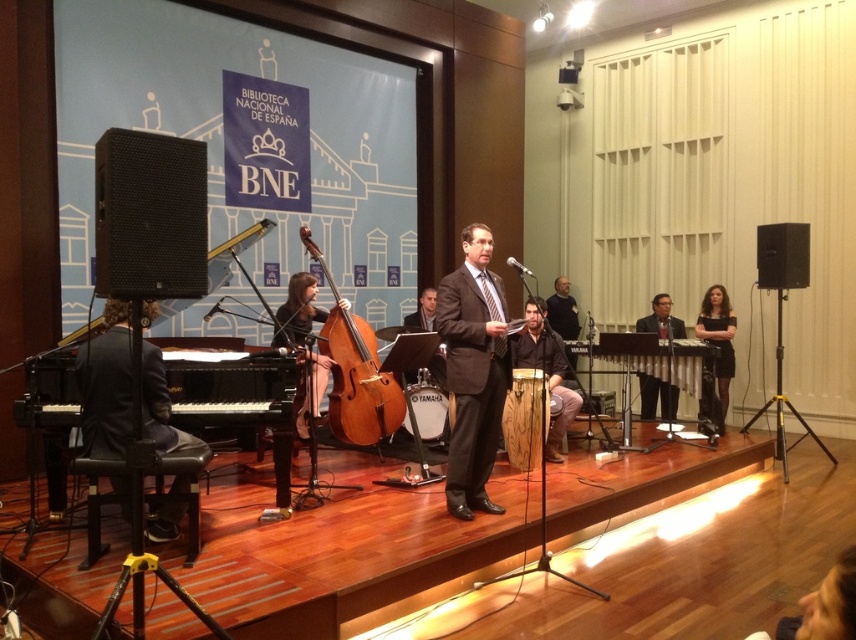
Who is positioned more to the left, brown wooden cello at center or matte brown cello at center?

matte brown cello at center

Does point (351, 426) come closer to viewer compared to point (310, 380)?

No, it is not.

The height and width of the screenshot is (640, 856). I want to click on brown wooden cello at center, so click(355, 371).

You are a GUI agent. You are given a task and a screenshot of the screen. Output one action in this format:
    pyautogui.click(x=<x>, y=<y>)
    Task: Click on the brown wooden cello at center
    
    Given the screenshot: What is the action you would take?
    pyautogui.click(x=355, y=371)

Is wooden drum at center above matte brown wooden chair at center?

No.

Does wooden drum at center appear on the left side of matte brown wooden chair at center?

Incorrect, wooden drum at center is not on the left side of matte brown wooden chair at center.

Image resolution: width=856 pixels, height=640 pixels. Identify the location of wooden drum at center. (525, 419).

Does brown wooden drum at center have a lesser height compared to dark brown leather jacket at center?

In fact, brown wooden drum at center may be taller than dark brown leather jacket at center.

Between point (574, 408) and point (565, 298), which one is positioned behind?

Positioned behind is point (565, 298).

The image size is (856, 640). I want to click on brown wooden drum at center, so click(545, 371).